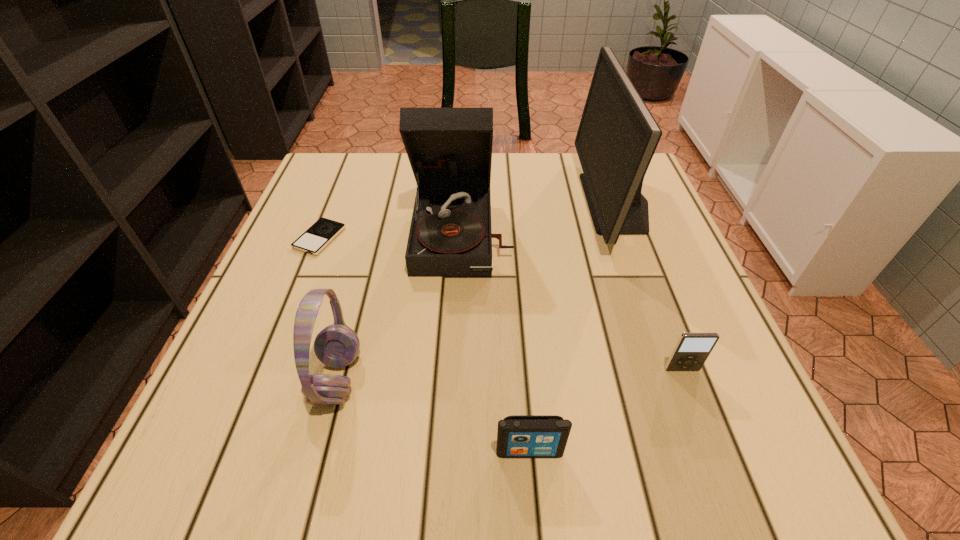
You are a GUI agent. You are given a task and a screenshot of the screen. Output one action in this format:
    pyautogui.click(x=<x>, y=<y>)
    Task: Click on the blank region between the rightmost iPod and the phonograph_record
    This screenshot has width=960, height=540.
    Given the screenshot: What is the action you would take?
    pyautogui.click(x=572, y=301)

Select which object is the third closest to the phonograph_record. Please provide its 2D coordinates. Your answer should be formatted as a tuple, i.e. [(x, y)], where the tuple contains the x and y coordinates of a point satisfying the conditions above.

[(617, 137)]

You are a GUI agent. You are given a task and a screenshot of the screen. Output one action in this format:
    pyautogui.click(x=<x>, y=<y>)
    Task: Click on the object that is the fourth closest to the computer monitor
    Image resolution: width=960 pixels, height=540 pixels.
    Given the screenshot: What is the action you would take?
    pyautogui.click(x=337, y=345)

At what (x,y) coordinates should I click in order to perform the action: click on iPod that is the third nearest to the computer monitor. Please return your answer as a coordinate pair (x, y). The width and height of the screenshot is (960, 540). Looking at the image, I should click on (323, 231).

Locate which iPod is the closest to the second iPod from right to left. Please provide its 2D coordinates. Your answer should be formatted as a tuple, i.e. [(x, y)], where the tuple contains the x and y coordinates of a point satisfying the conditions above.

[(692, 349)]

Identify the location of free point that satisfies the following two spatial constraints: 1. on the screen side of the computer monitor; 2. on the front side of the leftmost iPod. Image resolution: width=960 pixels, height=540 pixels. (629, 238).

Locate an element on the screen. The height and width of the screenshot is (540, 960). vacant region that satisfies the following two spatial constraints: 1. on the screen side of the computer monitor; 2. on the front screen of the nearest iPod is located at coordinates 708,451.

Locate an element on the screen. This screenshot has height=540, width=960. vacant area that satisfies the following two spatial constraints: 1. on the screen side of the computer monitor; 2. on the front-facing side of the phonograph_record is located at coordinates [x=627, y=233].

Find the location of a particular element. This screenshot has width=960, height=540. vacant space that satisfies the following two spatial constraints: 1. on the screen side of the computer monitor; 2. on the front-facing side of the phonograph_record is located at coordinates (627, 233).

I want to click on vacant space that satisfies the following two spatial constraints: 1. on the screen side of the computer monitor; 2. on the front side of the shortest object, so click(x=629, y=238).